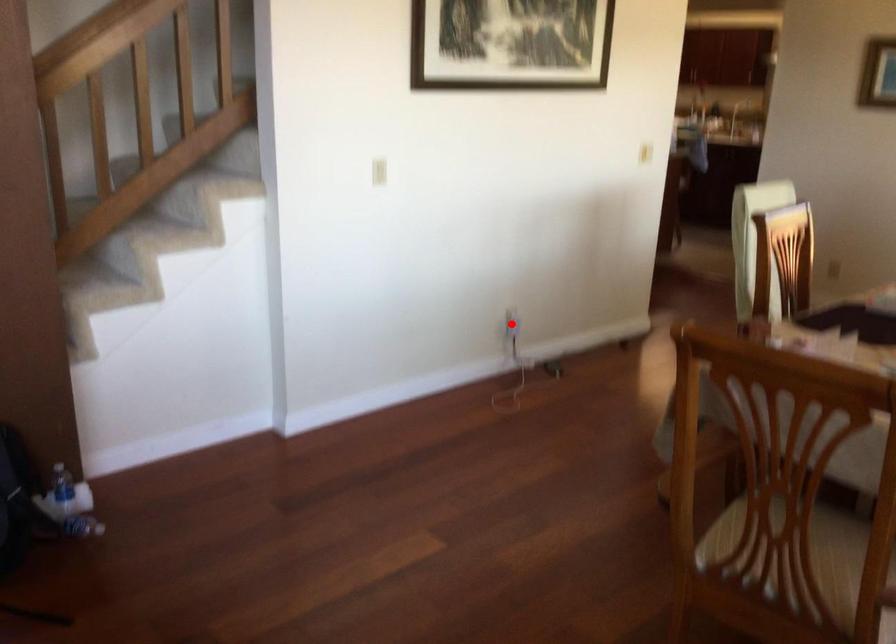
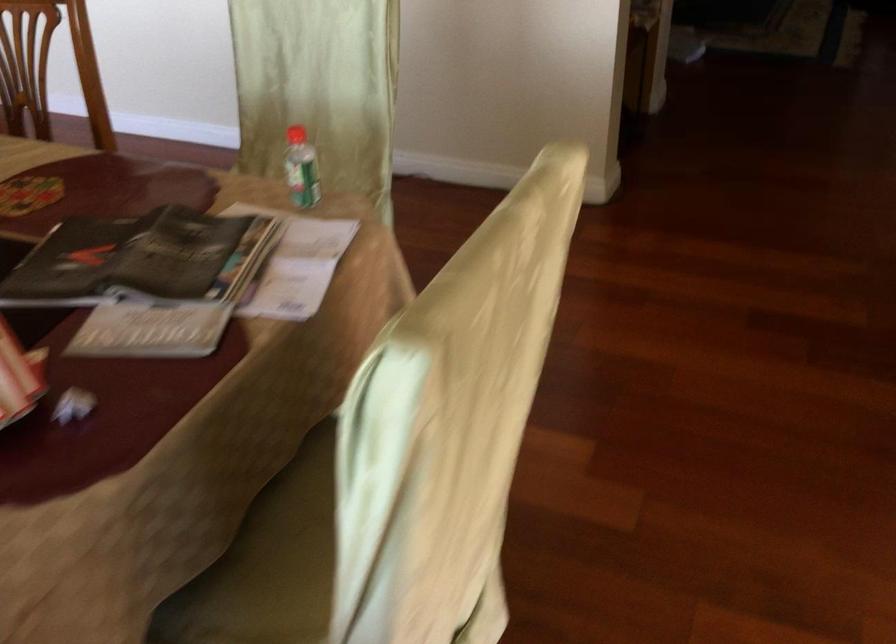
Question: I am providing you with two images of the same scene from different viewpoints. A red point is marked on the first image. Can you still see the location of the red point in image 2?

Choices:
 (A) Yes
 (B) No

Answer: (B)